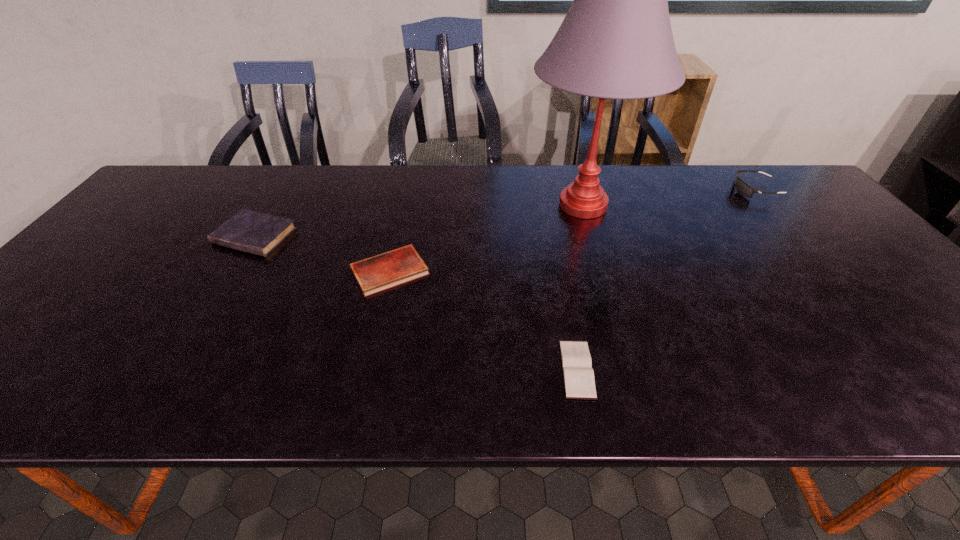
Where is `object located at the right edge`? The width and height of the screenshot is (960, 540). object located at the right edge is located at coordinates (743, 188).

This screenshot has height=540, width=960. What are the coordinates of `object that is at the far right corner` in the screenshot? It's located at (743, 188).

Locate an element on the screen. This screenshot has height=540, width=960. vacant space at the far edge of the desktop is located at coordinates (239, 188).

This screenshot has width=960, height=540. What are the coordinates of `free space at the near edge of the desktop` in the screenshot? It's located at (759, 379).

The height and width of the screenshot is (540, 960). What are the coordinates of `vacant space at the left edge of the desktop` in the screenshot? It's located at (24, 366).

This screenshot has height=540, width=960. Identify the location of free space at the right edge of the desktop. (828, 242).

This screenshot has width=960, height=540. What are the coordinates of `vacant space at the far right corner` in the screenshot? It's located at (776, 185).

Find the location of a particular element. Image resolution: width=960 pixels, height=540 pixels. vacant area at the near right corner is located at coordinates (935, 386).

Where is `free space between the table lamp and the rightmost object`? Image resolution: width=960 pixels, height=540 pixels. free space between the table lamp and the rightmost object is located at coordinates (669, 198).

This screenshot has height=540, width=960. Find the location of `empty location between the tallest object and the rightmost diary`. empty location between the tallest object and the rightmost diary is located at coordinates (580, 287).